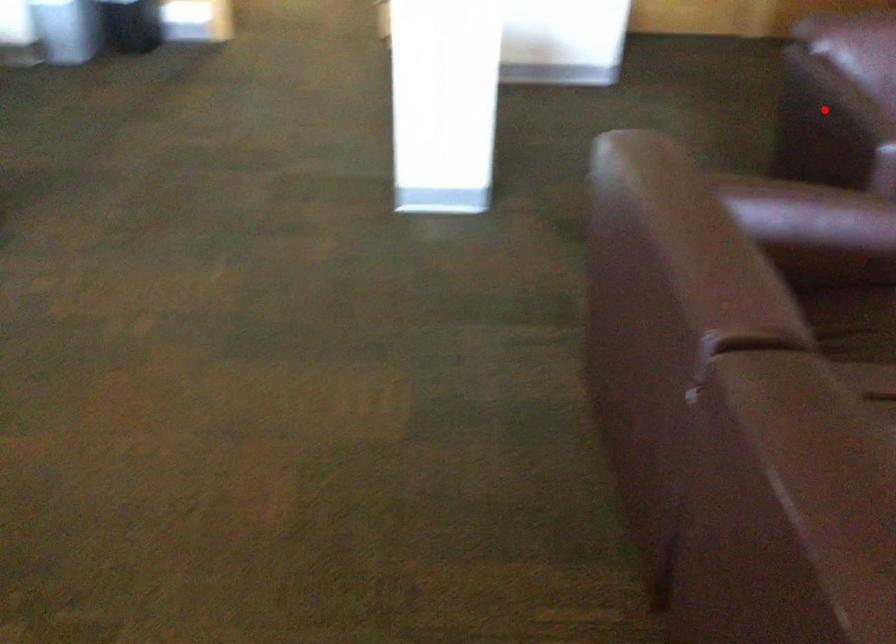
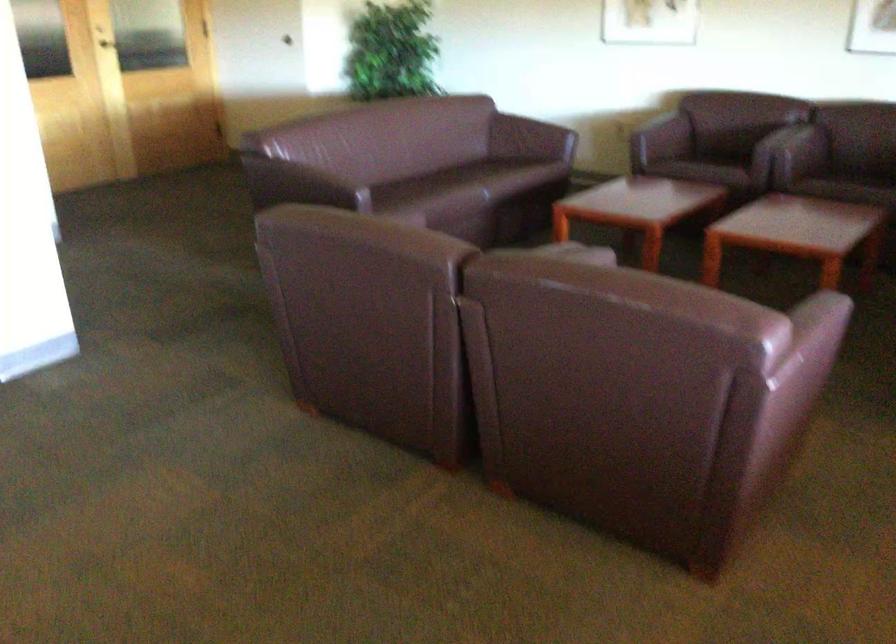
Locate, in the second image, the point that corresponds to the highlighted location in the first image.

(297, 184)